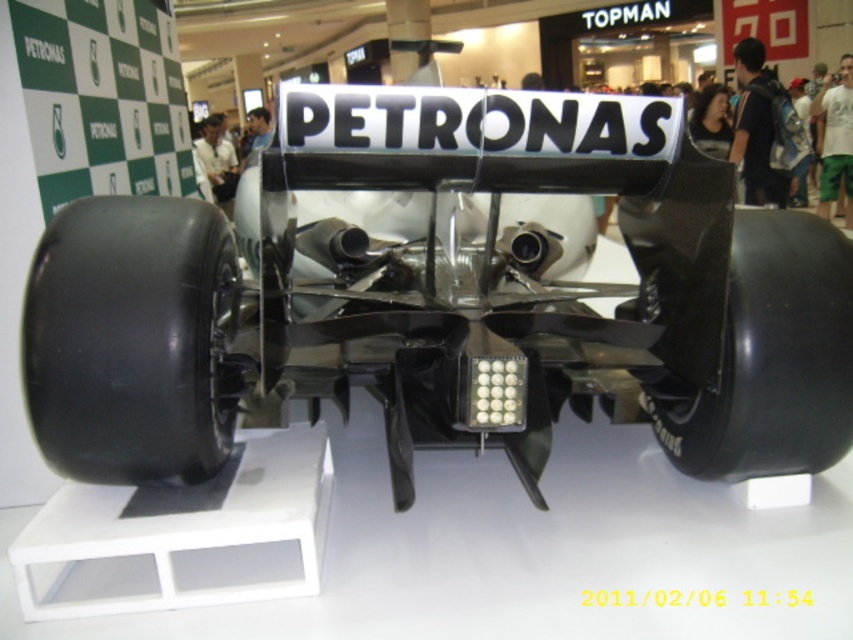
Does carbon fiber race car at center have a lesser height compared to black rubber wheel at lower left?

No, carbon fiber race car at center is not shorter than black rubber wheel at lower left.

Who is more distant from viewer, (845, 381) or (135, 467)?

Positioned behind is point (845, 381).

This screenshot has width=853, height=640. What do you see at coordinates (444, 301) in the screenshot? I see `carbon fiber race car at center` at bounding box center [444, 301].

This screenshot has height=640, width=853. What are the coordinates of `carbon fiber race car at center` in the screenshot? It's located at (444, 301).

Which is above, carbon fiber race car at center or black carbon fiber wheel at center?

carbon fiber race car at center

Is carbon fiber race car at center positioned before black carbon fiber wheel at center?

Yes, carbon fiber race car at center is closer to the viewer.

Is point (749, 266) positioned before point (778, 225)?

Yes, point (749, 266) is in front of point (778, 225).

Identify the location of carbon fiber race car at center. pos(444,301).

Can you confirm if black rubber wheel at lower left is bigger than black carbon fiber wheel at center?

No, black rubber wheel at lower left is not bigger than black carbon fiber wheel at center.

Between point (91, 340) and point (763, 385), which one is positioned behind?

Point (763, 385)

Between point (97, 262) and point (773, 442), which one is positioned in front?

Point (97, 262)

This screenshot has width=853, height=640. Identify the location of black rubber wheel at lower left. (132, 339).